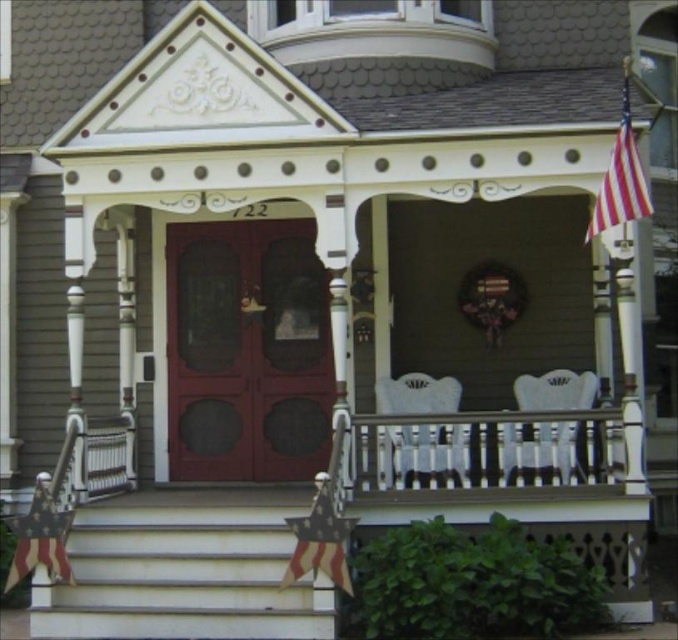
You are standing at a point 70 feet away from the matte wood door at center. Can you reach the door within 10 seconds if you walk towards it at a normal pace?

Result: The distance between you and the matte wood door at center is 69.33 feet, which is less than 70 feet. Walking at a normal pace of about 3 feet per second, you would cover 30 feet in 10 seconds. Since 69.33 feet is greater than 30 feet, you cannot reach the door within 10 seconds.

You are standing on the porch of the Victorian house and want to hand a package to someone through the door. The flag might block your view. Which object is closer to you, the matte wood door at center or the red striped fabric flag at upper right?

The matte wood door at center is closer to you than the red striped fabric flag at upper right, so the door won not be blocked by the flag.